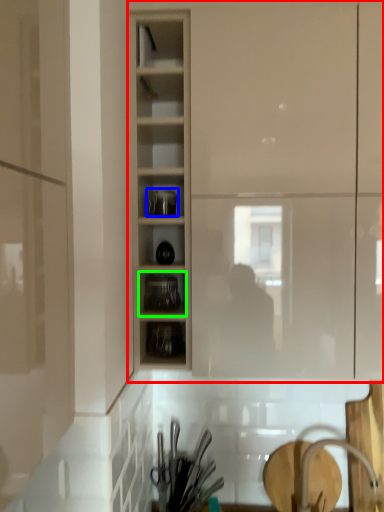
Question: Considering the real-world distances, which object is closest to cupboard (highlighted by a red box)? tableware (highlighted by a blue box) or shelf (highlighted by a green box).

Choices:
 (A) tableware
 (B) shelf

Answer: (A)